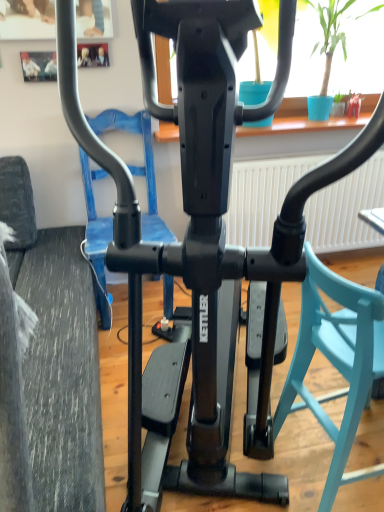
Question: Should I look upward or downward to see teal plastic swivel chair at center-right?

Choices:
 (A) down
 (B) up

Answer: (A)